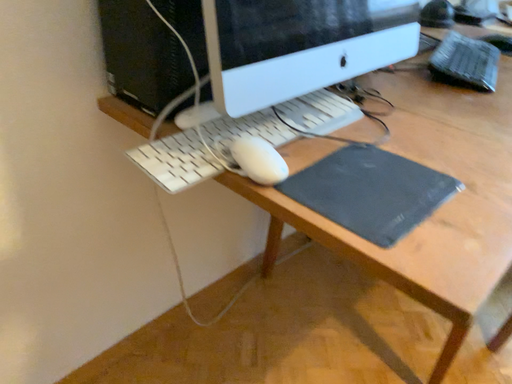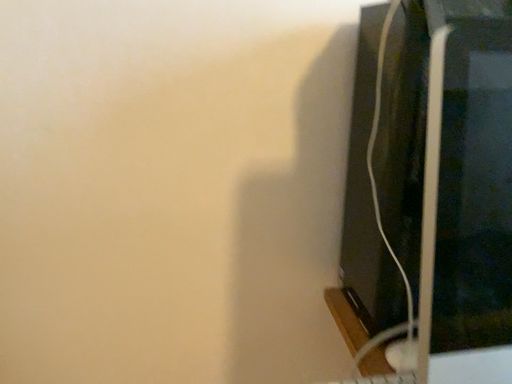
Question: Which way did the camera rotate in the video?

Choices:
 (A) rotated upward
 (B) rotated downward

Answer: (A)